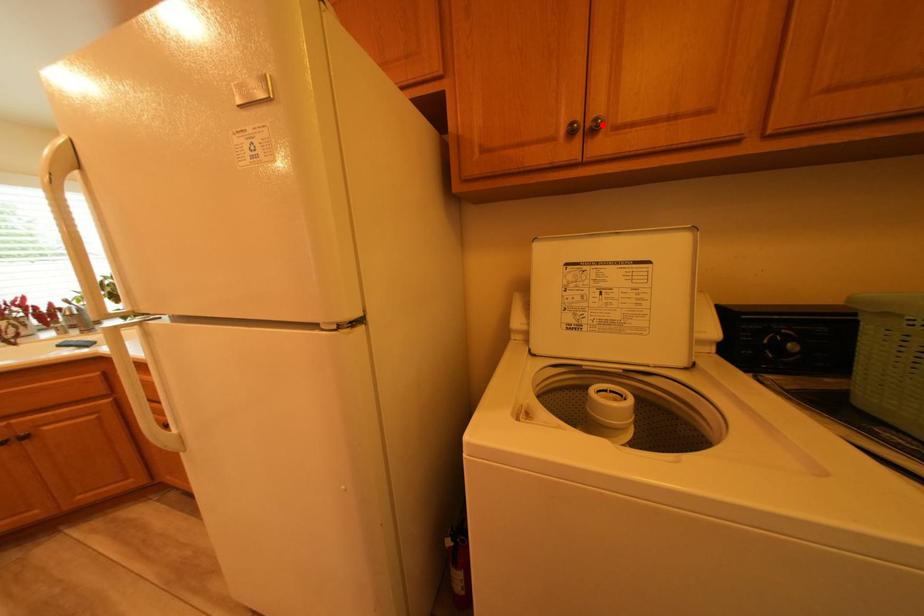
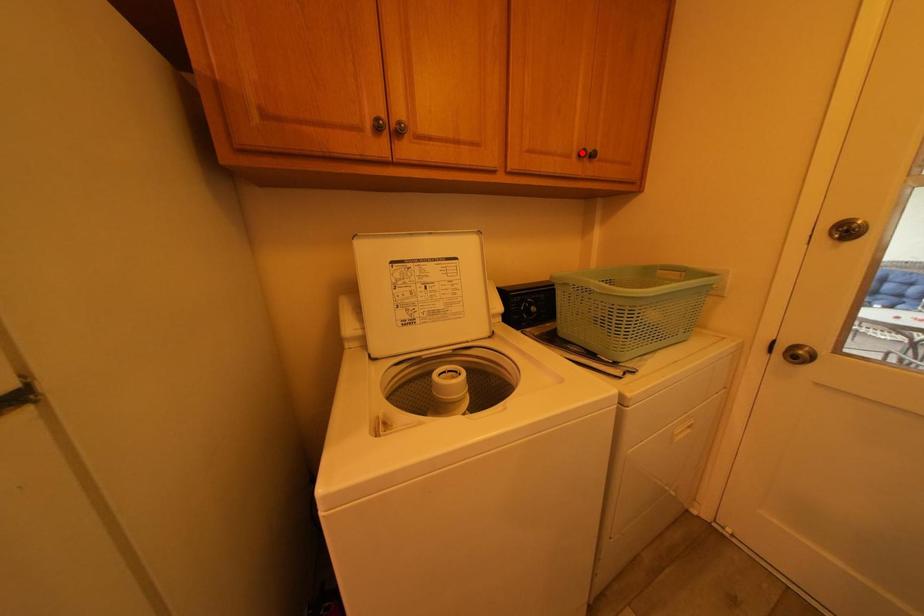
I am providing you with two images of the same scene from different viewpoints. A red point is marked on the first image and another point is marked on the second image. Are the points marked in image1 and image2 representing the same 3D position?

No